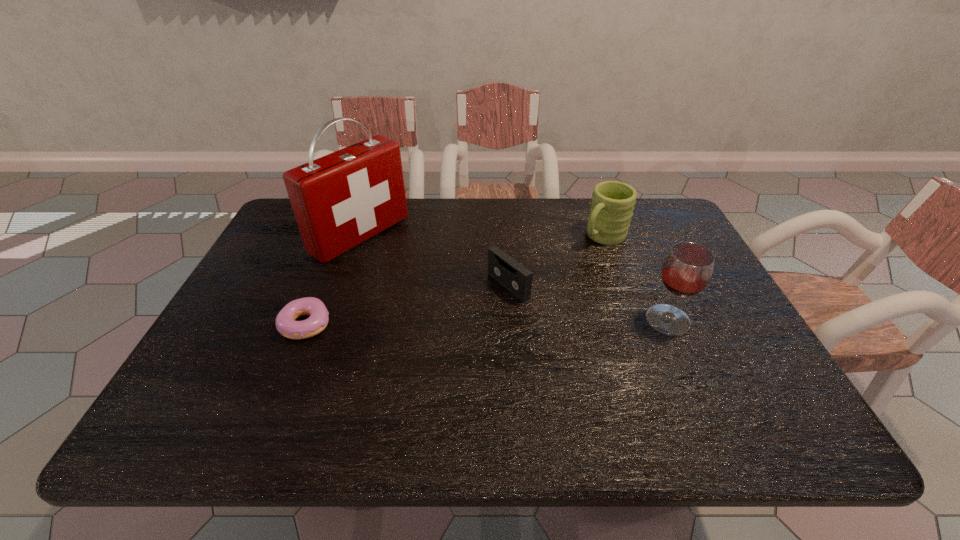
Identify the location of free space between the tallest object and the third object from right to left. (434, 261).

At what (x,y) coordinates should I click in order to perform the action: click on vacant region between the fourth shortest object and the mug. Please return your answer as a coordinate pair (x, y). Looking at the image, I should click on (636, 278).

The image size is (960, 540). Find the location of `vacant space in between the doughnut and the tallest object`. vacant space in between the doughnut and the tallest object is located at coordinates (333, 280).

Locate an element on the screen. free space that is in between the first-aid kit and the third object from left to right is located at coordinates (434, 261).

The image size is (960, 540). Identify the location of free point between the first-aid kit and the shortest object. (333, 280).

Where is `free area in between the shortest object and the tallest object`? This screenshot has width=960, height=540. free area in between the shortest object and the tallest object is located at coordinates tap(333, 280).

Locate an element on the screen. vacant area that lies between the wineglass and the doughnut is located at coordinates (487, 322).

Locate an element on the screen. Image resolution: width=960 pixels, height=540 pixels. free point between the first-aid kit and the third tallest object is located at coordinates (482, 236).

Locate an element on the screen. The image size is (960, 540). object identified as the closest to the videotape is located at coordinates (612, 204).

Identify which object is the second closest to the third object from right to left. Please provide its 2D coordinates. Your answer should be formatted as a tuple, i.e. [(x, y)], where the tuple contains the x and y coordinates of a point satisfying the conditions above.

[(340, 200)]